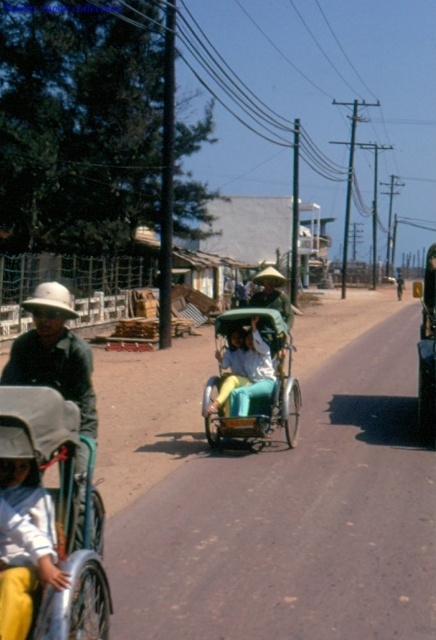
You are standing on the sidewalk and see the point marked at coordinates (252, 378). What object is located at that point?

The point at coordinates (252, 378) indicates the green fabric rickshaw at center.

You are a delivery person needing to reach the light blue fabric at lower left from the green fabric rickshaw at center. Given that your delivery cart is 1.5 meters wide, can you navigate the path between them?

The distance between the green fabric rickshaw at center and the light blue fabric at lower left is 4.79 meters. Since your cart is 1.5 meters wide, there is sufficient space to navigate the path between them.

You are a pedestrian standing at the intersection and want to cross the road to the park on the other side. There is a matte white coach at left and a light blue fabric at lower left in your view. Which object should you avoid stepping on to ensure safe passage?

You should avoid stepping on the light blue fabric at lower left because the matte white coach at left is positioned on the left side of it, meaning the coach is closer to the road and the fabric might be an obstacle near the edge.